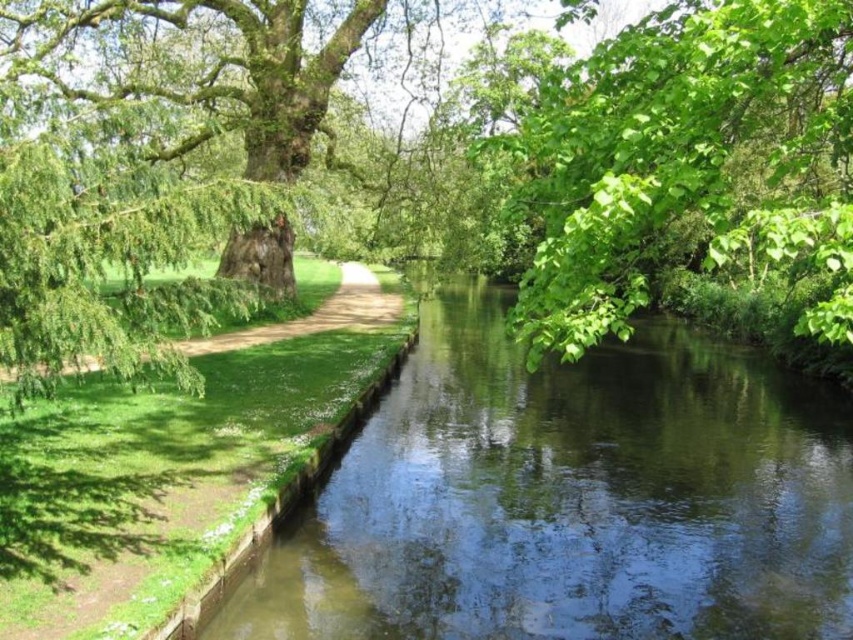
Who is lower down, green smooth water at center or green leafy tree at upper right?

Positioned lower is green smooth water at center.

Does green smooth water at center come in front of green leafy tree at upper right?

No, green smooth water at center is behind green leafy tree at upper right.

Is point (714, 493) positioned after point (770, 220)?

That is True.

Locate an element on the screen. green smooth water at center is located at coordinates (570, 499).

Looking at this image, is green leafy tree at upper right shorter than green grassy path at center?

In fact, green leafy tree at upper right may be taller than green grassy path at center.

Does green leafy tree at upper right have a greater width compared to green grassy path at center?

Yes, green leafy tree at upper right is wider than green grassy path at center.

Who is more forward, [646,179] or [354,304]?

Positioned in front is point [646,179].

At what (x,y) coordinates should I click in order to perform the action: click on green leafy tree at upper right. Please return your answer as a coordinate pair (x, y). The height and width of the screenshot is (640, 853). Looking at the image, I should click on (692, 179).

Is point (573, 577) closer to viewer compared to point (361, 308)?

Yes, point (573, 577) is in front of point (361, 308).

Locate an element on the screen. green smooth water at center is located at coordinates 570,499.